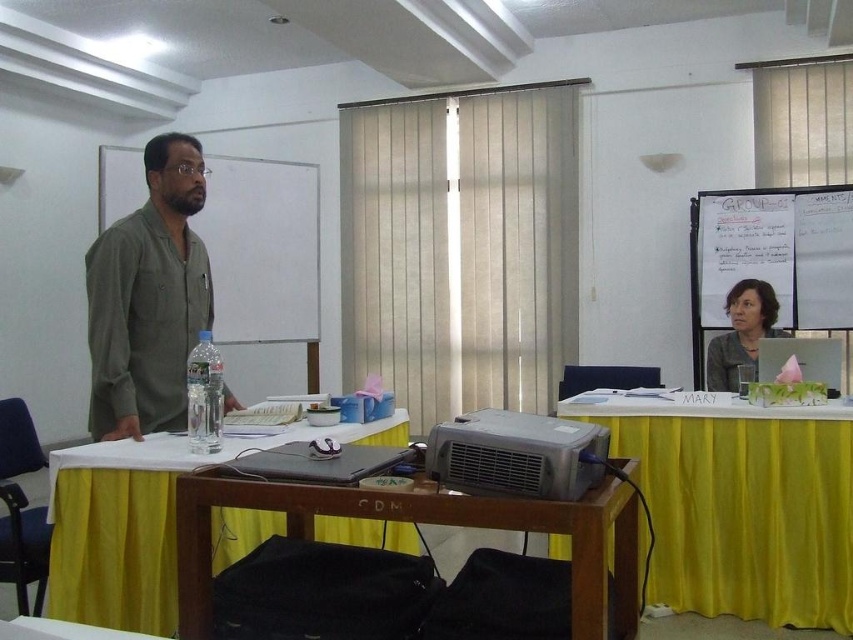
Is green matte shirt at left to the left of matte gray laptop at upper right from the viewer's perspective?

Correct, you'll find green matte shirt at left to the left of matte gray laptop at upper right.

Who is more distant from viewer, (107,326) or (741,317)?

Positioned behind is point (741,317).

You are a GUI agent. You are given a task and a screenshot of the screen. Output one action in this format:
    pyautogui.click(x=<x>, y=<y>)
    Task: Click on the green matte shirt at left
    Image resolution: width=853 pixels, height=640 pixels.
    Given the screenshot: What is the action you would take?
    pyautogui.click(x=148, y=298)

Is white matte board at upper center thinner than whiteboard at upper right?

Yes.

Is white matte board at upper center to the left of whiteboard at upper right from the viewer's perspective?

Correct, you'll find white matte board at upper center to the left of whiteboard at upper right.

In order to click on white matte board at upper center in this screenshot , I will do [x=262, y=248].

Which is above, yellow fabric table at lower right or black matte laptop at center?

Positioned higher is black matte laptop at center.

Is yellow fabric table at lower right shorter than black matte laptop at center?

No.

Describe the element at coordinates (741, 506) in the screenshot. This screenshot has width=853, height=640. I see `yellow fabric table at lower right` at that location.

Locate an element on the screen. This screenshot has width=853, height=640. yellow fabric table at lower right is located at coordinates (741, 506).